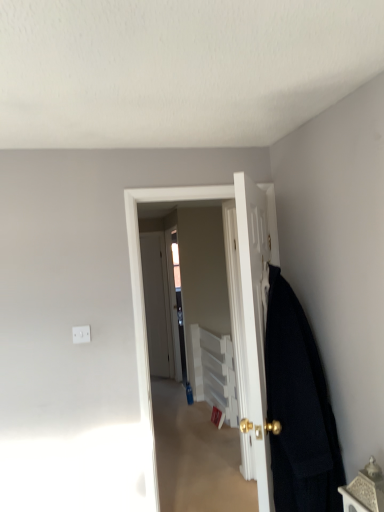
You are a GUI agent. You are given a task and a screenshot of the screen. Output one action in this format:
    pyautogui.click(x=<x>, y=<y>)
    Task: Click on the vacant area that is in front of white plastic cabinet at center
    Image resolution: width=384 pixels, height=512 pixels.
    Given the screenshot: What is the action you would take?
    pyautogui.click(x=195, y=438)